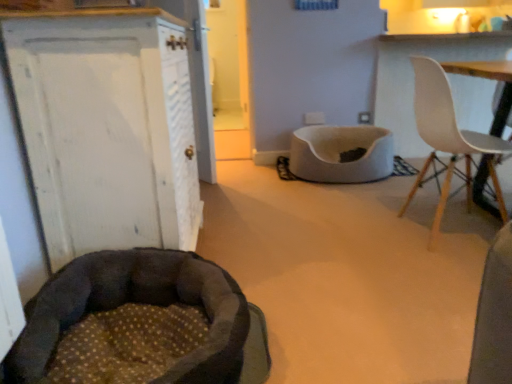
Question: Would you say dark brown plush dog bed at lower left is part of white painted wood cabinet at left's contents?

Choices:
 (A) no
 (B) yes

Answer: (A)

Question: Considering the relative sizes of white painted wood cabinet at left and dark brown plush dog bed at lower left in the image provided, is white painted wood cabinet at left taller than dark brown plush dog bed at lower left?

Choices:
 (A) no
 (B) yes

Answer: (B)

Question: Is white painted wood cabinet at left placed right next to dark brown plush dog bed at lower left?

Choices:
 (A) yes
 (B) no

Answer: (B)

Question: Is white painted wood cabinet at left oriented towards dark brown plush dog bed at lower left?

Choices:
 (A) yes
 (B) no

Answer: (B)

Question: Does white painted wood cabinet at left come behind dark brown plush dog bed at lower left?

Choices:
 (A) no
 (B) yes

Answer: (B)

Question: From the image's perspective, is white painted wood cabinet at left on top of dark brown plush dog bed at lower left?

Choices:
 (A) no
 (B) yes

Answer: (B)

Question: Considering the relative sizes of white painted wood cabinet at left and white soft pet bed at center in the image provided, is white painted wood cabinet at left bigger than white soft pet bed at center?

Choices:
 (A) yes
 (B) no

Answer: (A)

Question: Is white painted wood cabinet at left surrounding white soft pet bed at center?

Choices:
 (A) yes
 (B) no

Answer: (B)

Question: Can you confirm if white painted wood cabinet at left is wider than white soft pet bed at center?

Choices:
 (A) yes
 (B) no

Answer: (B)

Question: From the image's perspective, does white painted wood cabinet at left appear higher than white soft pet bed at center?

Choices:
 (A) no
 (B) yes

Answer: (A)

Question: Is white painted wood cabinet at left to the right of white soft pet bed at center from the viewer's perspective?

Choices:
 (A) yes
 (B) no

Answer: (B)

Question: Is white painted wood cabinet at left completely or partially outside of white soft pet bed at center?

Choices:
 (A) yes
 (B) no

Answer: (A)

Question: Can we say white painted wood cabinet at left lies outside white plastic chair at upper right?

Choices:
 (A) no
 (B) yes

Answer: (B)